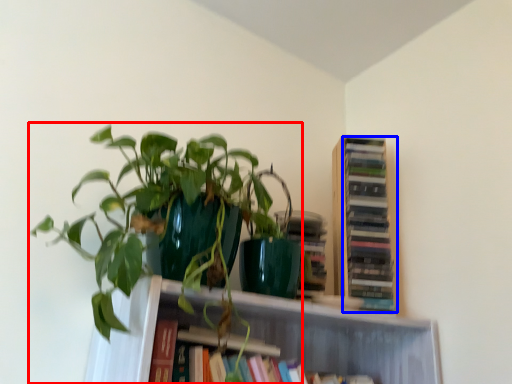
Question: Which of the following is the closest to the observer, houseplant (highlighted by a red box) or book (highlighted by a blue box)?

Choices:
 (A) houseplant
 (B) book

Answer: (A)